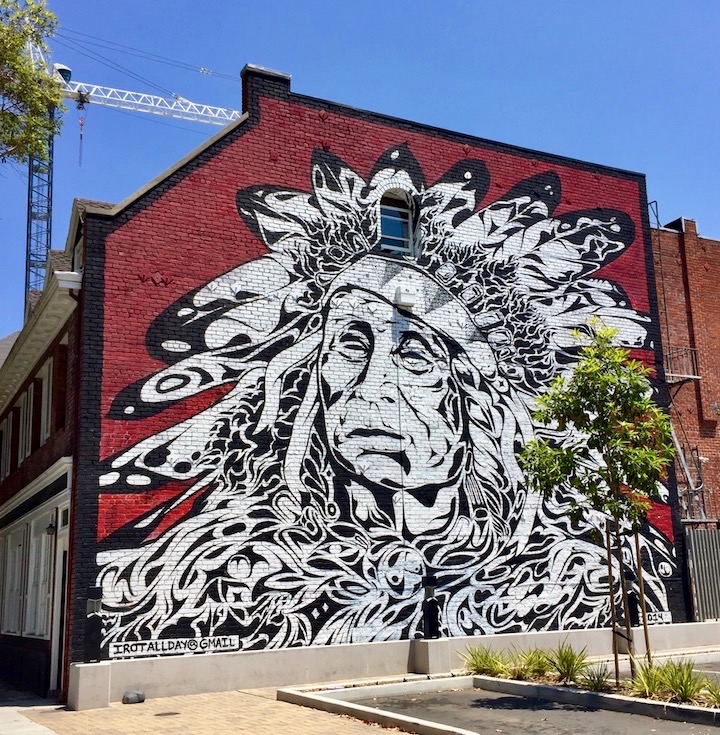
This screenshot has height=735, width=720. I want to click on door, so click(60, 584).